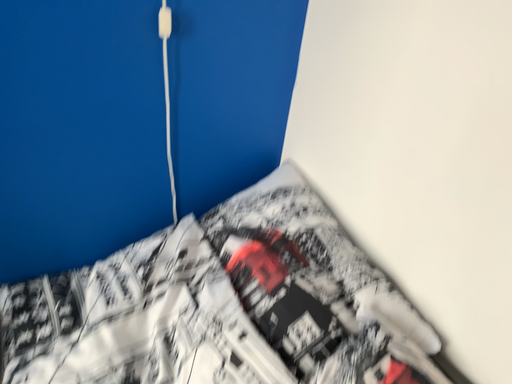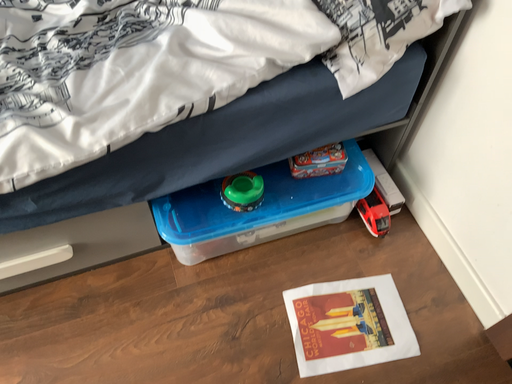
Question: How did the camera likely rotate when shooting the video?

Choices:
 (A) rotated upward
 (B) rotated downward

Answer: (B)